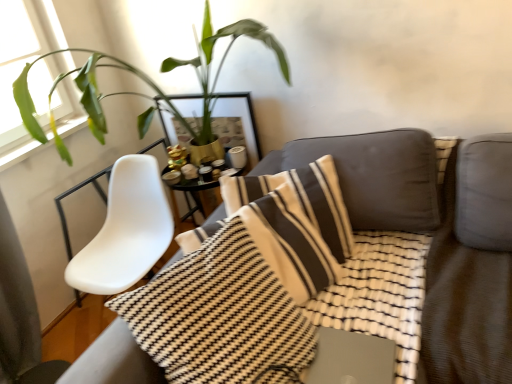
Find the location of a particular element. The height and width of the screenshot is (384, 512). vacant area on top of metallic silver laptop at center (from a real-world perspective) is located at coordinates tap(346, 361).